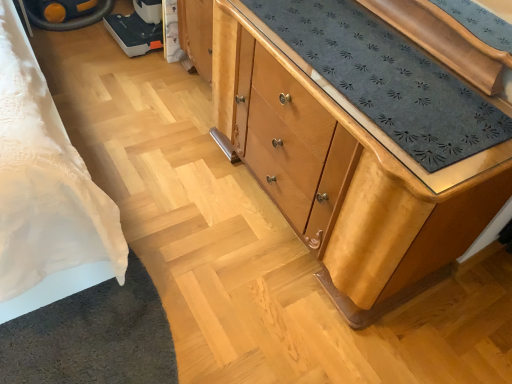
Question: Is light brown wood chest of drawers at center aimed at yellow rubber wheel at upper left?

Choices:
 (A) yes
 (B) no

Answer: (B)

Question: From the image's perspective, is light brown wood chest of drawers at center located beneath yellow rubber wheel at upper left?

Choices:
 (A) yes
 (B) no

Answer: (A)

Question: Considering the relative sizes of light brown wood chest of drawers at center and yellow rubber wheel at upper left in the image provided, is light brown wood chest of drawers at center smaller than yellow rubber wheel at upper left?

Choices:
 (A) yes
 (B) no

Answer: (B)

Question: From a real-world perspective, is light brown wood chest of drawers at center beneath yellow rubber wheel at upper left?

Choices:
 (A) no
 (B) yes

Answer: (A)

Question: Does light brown wood chest of drawers at center appear on the left side of yellow rubber wheel at upper left?

Choices:
 (A) yes
 (B) no

Answer: (B)

Question: Is light brown wood chest of drawers at center wider than yellow rubber wheel at upper left?

Choices:
 (A) yes
 (B) no

Answer: (B)

Question: Can you confirm if yellow rubber wheel at upper left is positioned to the left of light brown wood chest of drawers at center?

Choices:
 (A) no
 (B) yes

Answer: (B)

Question: Is yellow rubber wheel at upper left far away from light brown wood chest of drawers at center?

Choices:
 (A) no
 (B) yes

Answer: (B)

Question: Does yellow rubber wheel at upper left come in front of light brown wood chest of drawers at center?

Choices:
 (A) no
 (B) yes

Answer: (A)

Question: From the image's perspective, is yellow rubber wheel at upper left over light brown wood chest of drawers at center?

Choices:
 (A) yes
 (B) no

Answer: (A)

Question: From the image's perspective, does yellow rubber wheel at upper left appear lower than light brown wood chest of drawers at center?

Choices:
 (A) yes
 (B) no

Answer: (B)

Question: Is yellow rubber wheel at upper left completely or partially outside of light brown wood chest of drawers at center?

Choices:
 (A) yes
 (B) no

Answer: (A)

Question: Based on their sizes in the image, would you say yellow rubber wheel at upper left is bigger or smaller than light brown wood chest of drawers at center?

Choices:
 (A) big
 (B) small

Answer: (B)